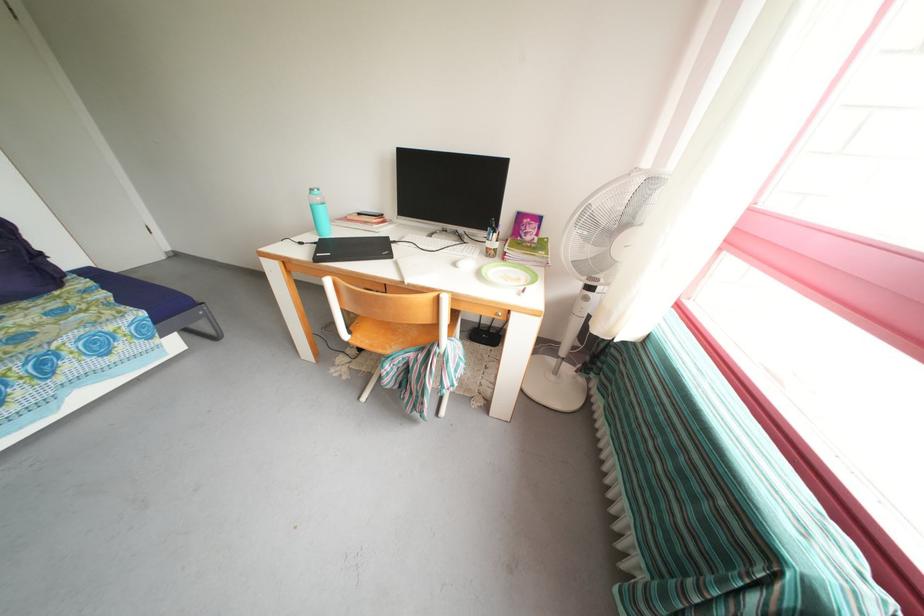
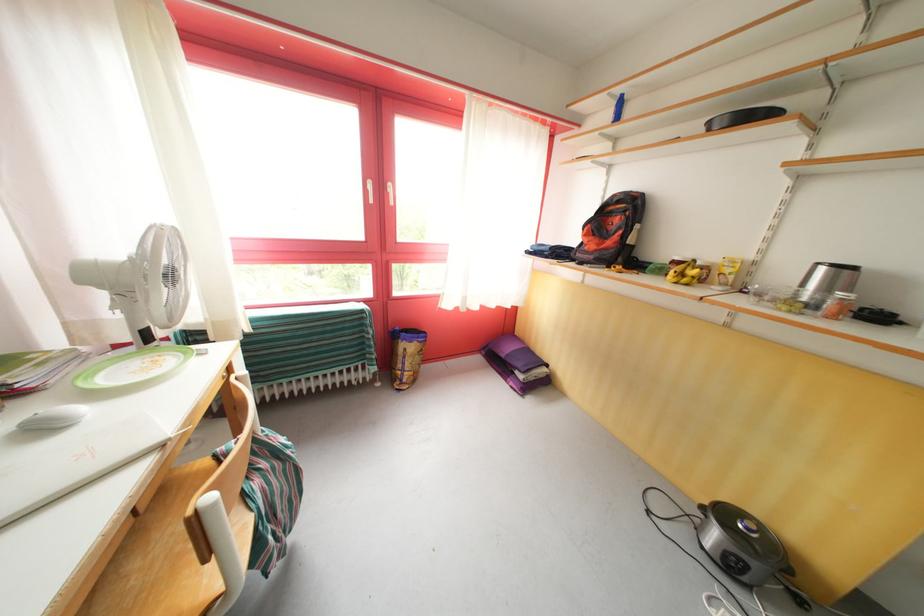
Where in the second image is the point corresponding to (533,276) from the first image?

(128, 363)